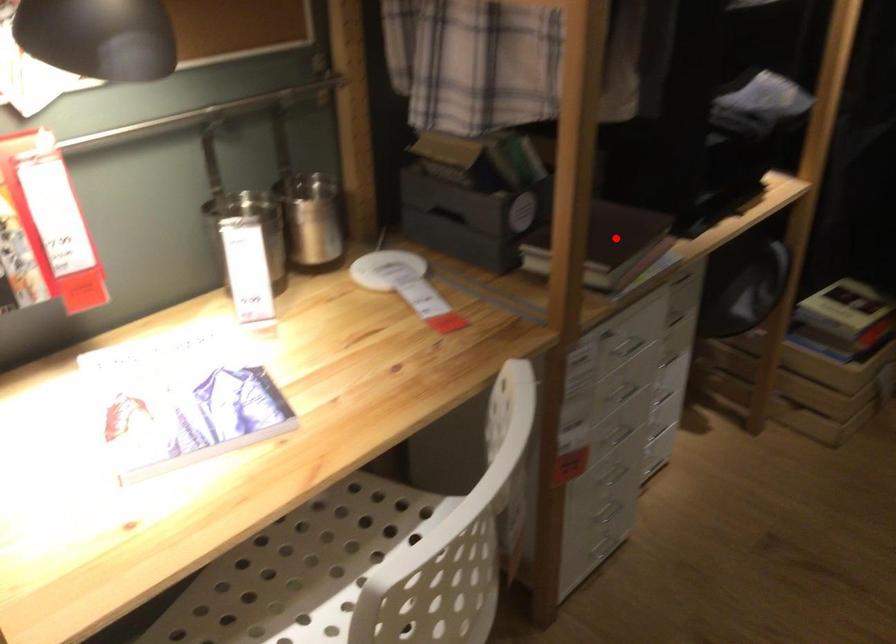
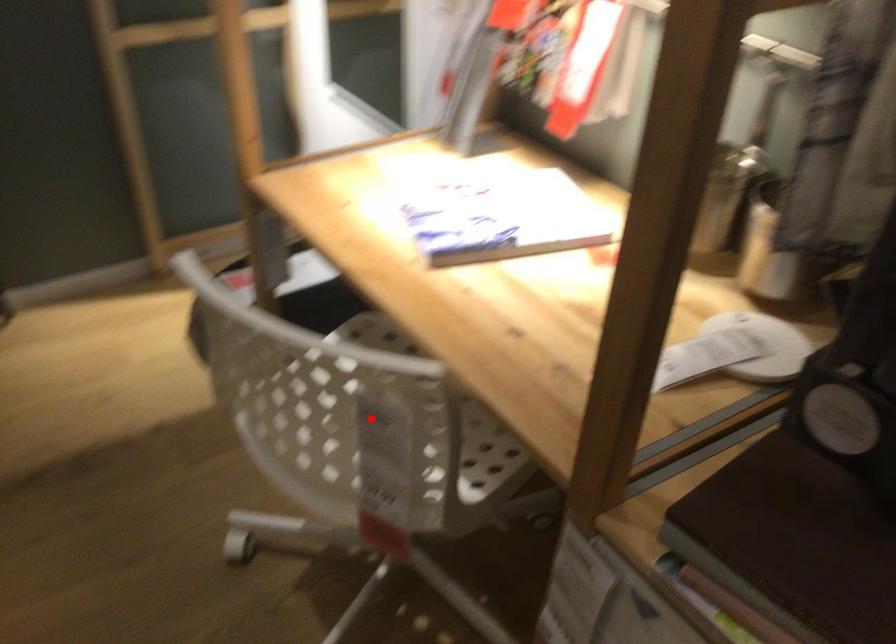
I am providing you with two images of the same scene from different viewpoints. A red point is marked on the first image and another point is marked on the second image. Does the point marked in image1 correspond to the same location as the one in image2?

No